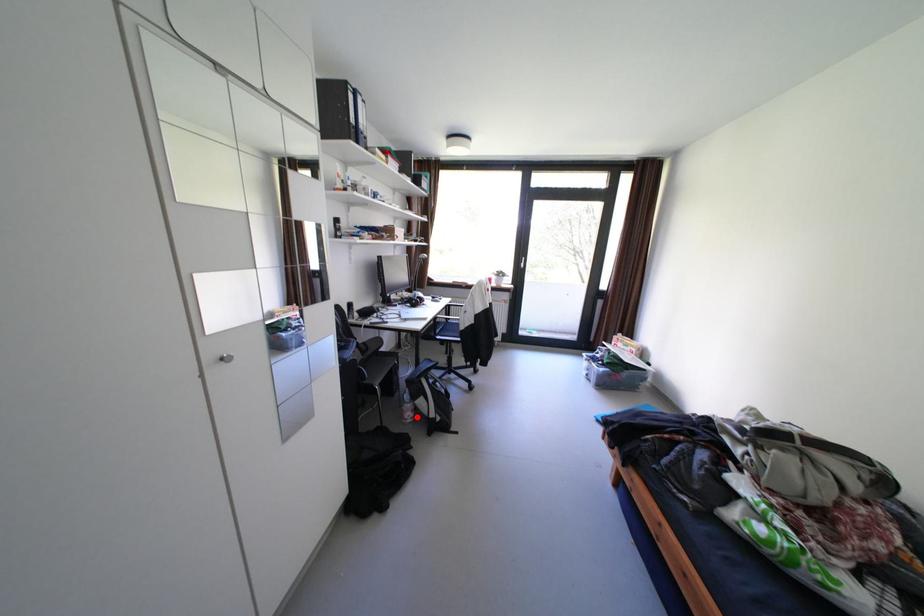
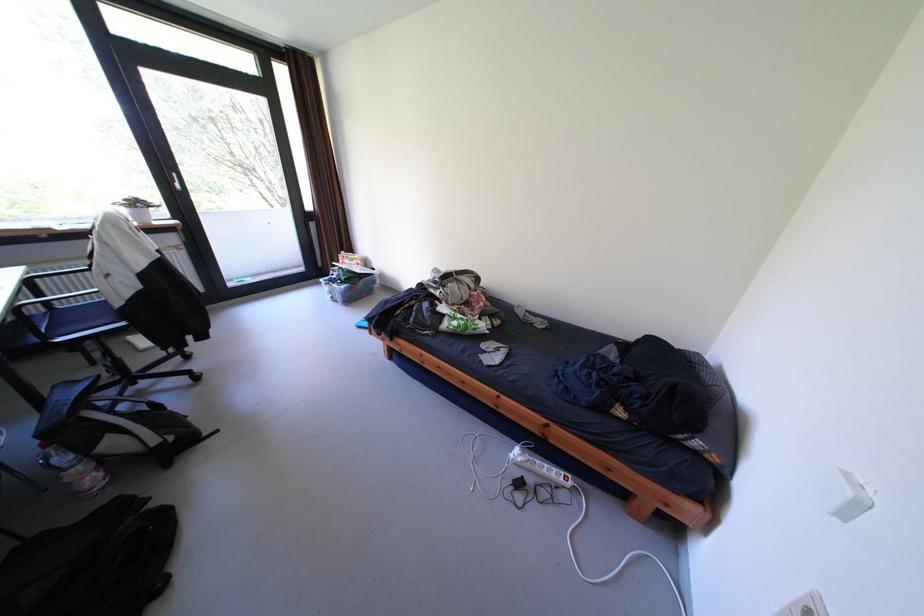
Question: I am providing you with two images of the same scene from different viewpoints. In image1, a red point is highlighted. Considering the same 3D point in image2, which of the following is correct?

Choices:
 (A) It is closer
 (B) It is farther

Answer: (A)